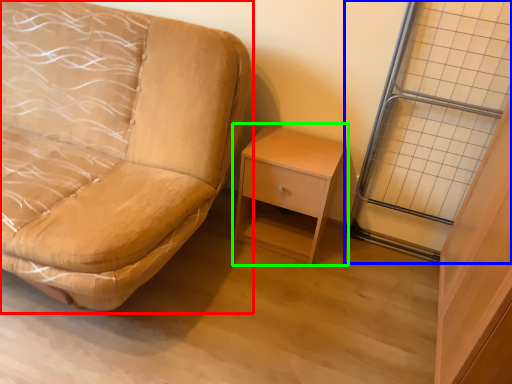
Question: Estimate the real-world distances between objects in this image. Which object is farther from studio couch (highlighted by a red box), glass door (highlighted by a blue box) or nightstand (highlighted by a green box)?

Choices:
 (A) glass door
 (B) nightstand

Answer: (A)